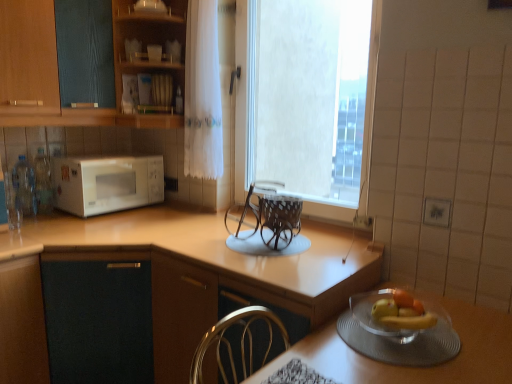
This screenshot has height=384, width=512. What are the coordinates of `free space in front of brown woven basket at center` in the screenshot? It's located at (265, 264).